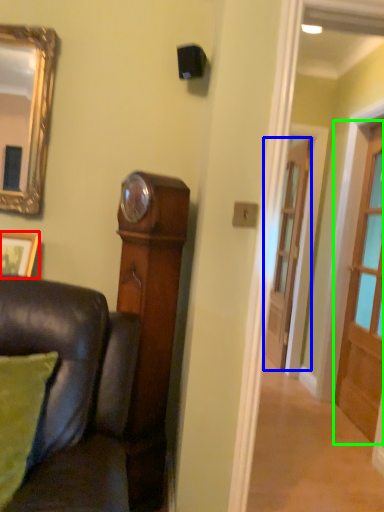
Question: Estimate the real-world distances between objects in this image. Which object is closer to picture frame (highlighted by a red box), door (highlighted by a blue box) or door (highlighted by a green box)?

Choices:
 (A) door
 (B) door

Answer: (B)